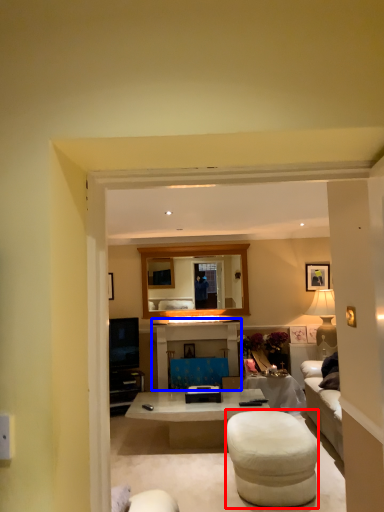
Question: Which point is further to the camera, bar stool (highlighted by a red box) or entertainment center (highlighted by a blue box)?

Choices:
 (A) bar stool
 (B) entertainment center

Answer: (B)